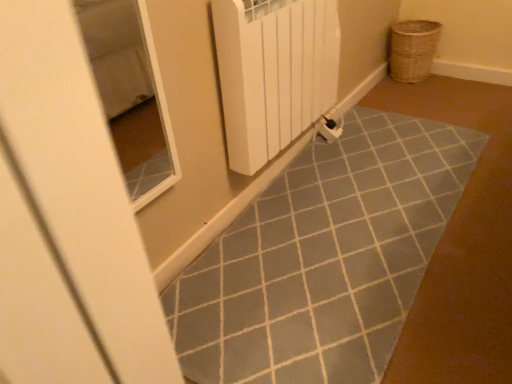
Question: Is point (336, 59) positioned closer to the camera than point (424, 41)?

Choices:
 (A) farther
 (B) closer

Answer: (B)

Question: Considering their positions, is white plastic radiator at center located in front of or behind woven brown basket at upper right?

Choices:
 (A) behind
 (B) front

Answer: (B)

Question: Considering the positions of white plastic radiator at center and woven brown basket at upper right in the image, is white plastic radiator at center wider or thinner than woven brown basket at upper right?

Choices:
 (A) thin
 (B) wide

Answer: (A)

Question: Based on their positions, is woven brown basket at upper right located to the left or right of white plastic radiator at center?

Choices:
 (A) left
 (B) right

Answer: (B)

Question: Do you think woven brown basket at upper right is within white plastic radiator at center, or outside of it?

Choices:
 (A) outside
 (B) inside

Answer: (A)

Question: From the image's perspective, is woven brown basket at upper right positioned above or below white plastic radiator at center?

Choices:
 (A) above
 (B) below

Answer: (A)

Question: Is woven brown basket at upper right in front of or behind white plastic radiator at center in the image?

Choices:
 (A) behind
 (B) front

Answer: (A)